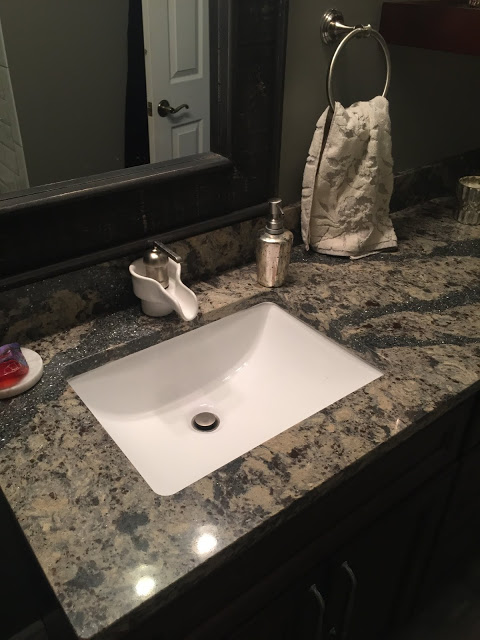
Identify the location of faucet. (169, 287).